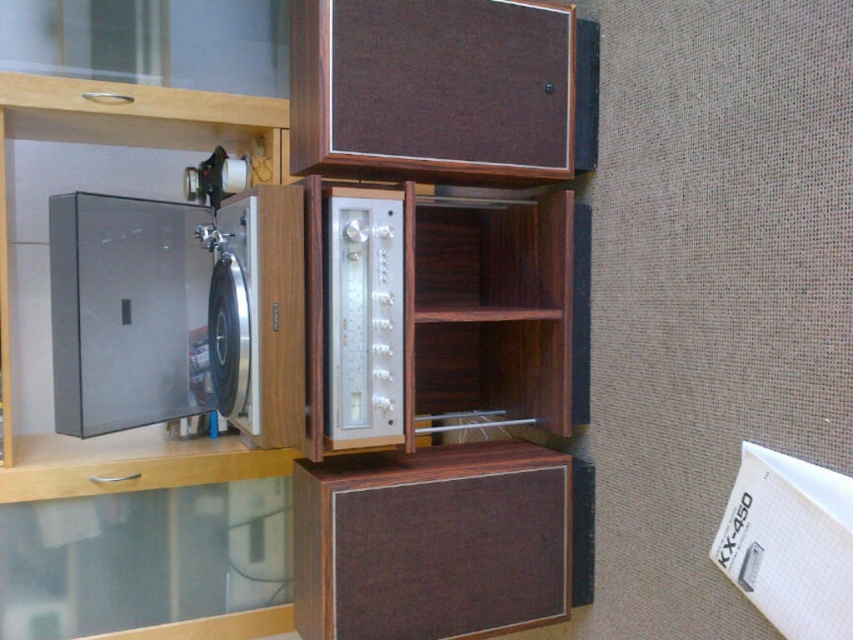
Based on the photo, how far apart are wooden cabinet at upper center and brown wood speaker at lower center?

wooden cabinet at upper center is 28.92 inches away from brown wood speaker at lower center.

This screenshot has height=640, width=853. What do you see at coordinates (136, 536) in the screenshot? I see `wooden cabinet at upper center` at bounding box center [136, 536].

This screenshot has width=853, height=640. I want to click on wooden cabinet at upper center, so click(x=136, y=536).

The height and width of the screenshot is (640, 853). Describe the element at coordinates (126, 312) in the screenshot. I see `metallic silver record player at left` at that location.

Can you confirm if metallic silver record player at left is positioned above silver metallic amplifier at center?

Correct, metallic silver record player at left is located above silver metallic amplifier at center.

This screenshot has width=853, height=640. Identify the location of metallic silver record player at left. (126, 312).

At what (x,y) coordinates should I click in order to perform the action: click on metallic silver record player at left. Please return your answer as a coordinate pair (x, y). Looking at the image, I should click on (126, 312).

Is brown wood speaker at lower center in front of metallic silver record player at left?

Yes, brown wood speaker at lower center is in front of metallic silver record player at left.

Does brown wood speaker at lower center have a greater height compared to metallic silver record player at left?

No, brown wood speaker at lower center is not taller than metallic silver record player at left.

Describe the element at coordinates (431, 541) in the screenshot. I see `brown wood speaker at lower center` at that location.

Where is `brown wood speaker at lower center`? brown wood speaker at lower center is located at coordinates (431, 541).